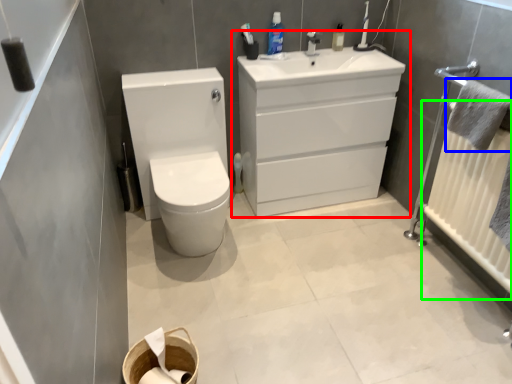
Question: Which object is the closest to the bathroom cabinet (highlighted by a red box)? Choose among these: bath towel (highlighted by a blue box) or radiator (highlighted by a green box).

Choices:
 (A) bath towel
 (B) radiator

Answer: (B)